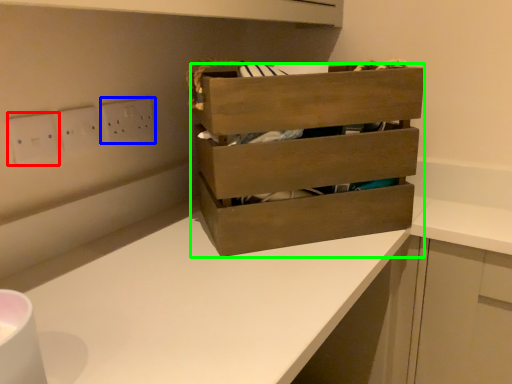
Question: Considering the real-world distances, which object is closest to electric outlet (highlighted by a red box)? electric outlet (highlighted by a blue box) or chest of drawers (highlighted by a green box).

Choices:
 (A) electric outlet
 (B) chest of drawers

Answer: (A)